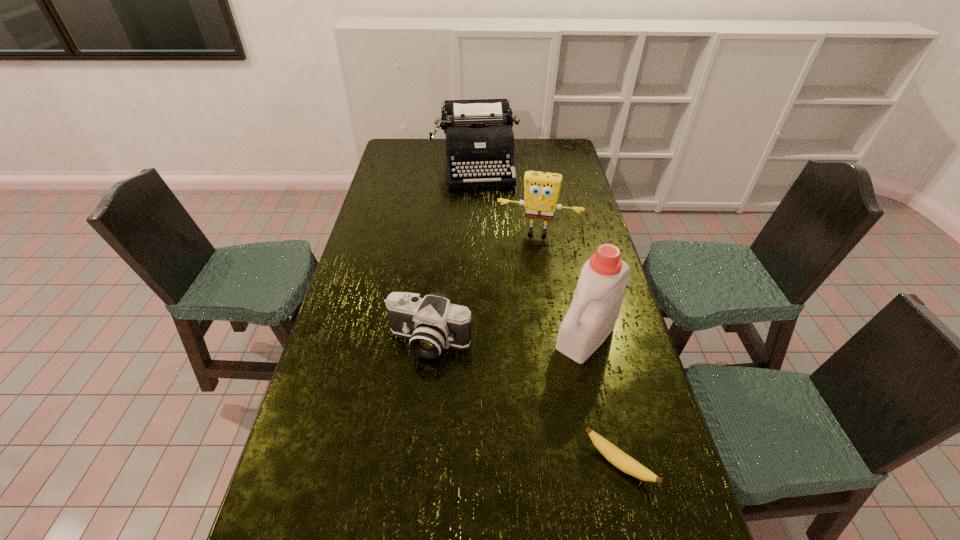
At what (x,y) coordinates should I click in order to perform the action: click on free area in between the typewriter and the camera. Please return your answer as a coordinate pair (x, y). The width and height of the screenshot is (960, 540). Looking at the image, I should click on (453, 253).

I want to click on vacant space in between the nearest object and the camera, so click(x=524, y=402).

Where is `empty location between the camera and the tallest object`? The width and height of the screenshot is (960, 540). empty location between the camera and the tallest object is located at coordinates [x=508, y=339].

You are a GUI agent. You are given a task and a screenshot of the screen. Output one action in this format:
    pyautogui.click(x=<x>, y=<y>)
    Task: Click on the free space between the typewriter and the sponge
    
    Given the screenshot: What is the action you would take?
    pyautogui.click(x=507, y=198)

This screenshot has width=960, height=540. Identify the location of unoccupied position between the banana and the tallest object. (602, 400).

This screenshot has height=540, width=960. What are the coordinates of `vacant space in between the detergent and the second shortest object` in the screenshot? It's located at (508, 339).

Where is `free space between the nearest object and the farthest object`? The image size is (960, 540). free space between the nearest object and the farthest object is located at coordinates (547, 314).

Locate an element on the screen. unoccupied area between the detergent and the camera is located at coordinates (508, 339).

Identify the location of vacant point located between the typewriter and the detergent. (531, 251).

Identify which object is the second nearest to the typewriter. Please provide its 2D coordinates. Your answer should be formatted as a tuple, i.e. [(x, y)], where the tuple contains the x and y coordinates of a point satisfying the conditions above.

[(591, 317)]